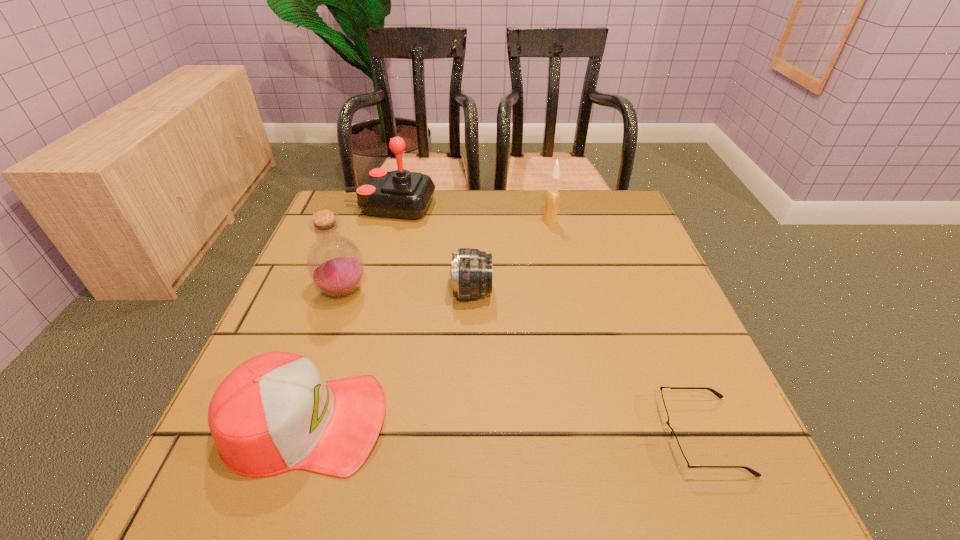
This screenshot has width=960, height=540. In the image, there is a desktop. Identify the location of blank space at the far left corner. (366, 215).

This screenshot has width=960, height=540. I want to click on free space at the far right corner of the desktop, so click(x=570, y=195).

Identify the location of vacant space at the near right corner of the desktop. (658, 447).

I want to click on vacant space in between the telephoto lens and the shortest object, so click(x=587, y=363).

Where is `vacant region between the telephoto lens and the joystick`? This screenshot has height=540, width=960. vacant region between the telephoto lens and the joystick is located at coordinates click(x=431, y=249).

Where is `vacant space in between the baseball cap and the spectacles`? The height and width of the screenshot is (540, 960). vacant space in between the baseball cap and the spectacles is located at coordinates 504,429.

I want to click on blank region between the bottle and the baseball cap, so click(324, 357).

Find the location of a particular element. free area in between the telephoto lens and the joystick is located at coordinates (431, 249).

The image size is (960, 540). Identify the location of vacant region between the joystick and the bottle. (367, 248).

Find the location of a particular element. The image size is (960, 540). free space between the candle and the shortest object is located at coordinates (626, 328).